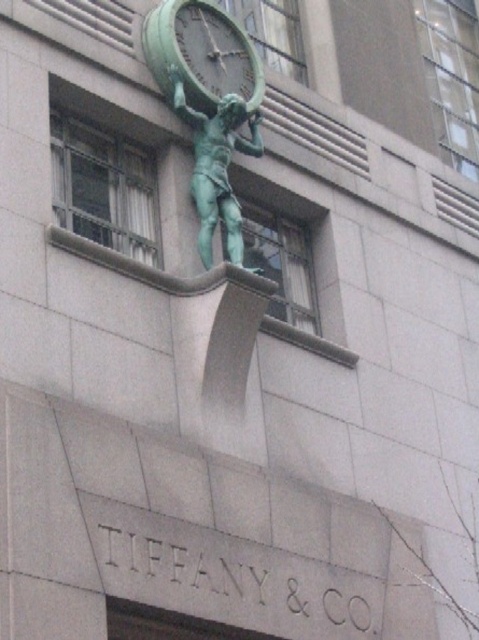
In the scene shown: Which of these two, green patina clock at upper center or green patina statue at center, stands shorter?

green patina clock at upper center

Does green patina clock at upper center appear on the left side of green patina statue at center?

Yes, green patina clock at upper center is to the left of green patina statue at center.

Which is behind, point (185, 29) or point (213, 157)?

The point (185, 29) is more distant.

Identify the location of green patina clock at upper center. (202, 52).